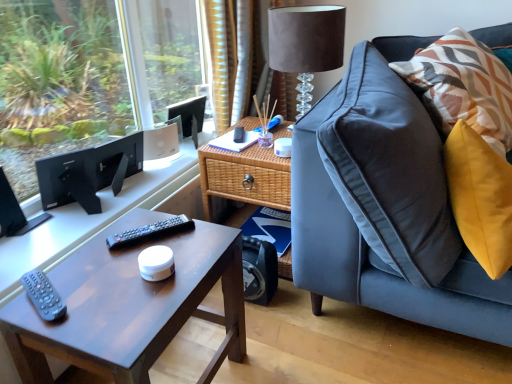
Image resolution: width=512 pixels, height=384 pixels. Find the location of `vacant space that's between black plastic remote at lower left, which ranks as the 2th remote in right-to-left order, and black plastic remote at center, the second remote ordered from the bottom`. vacant space that's between black plastic remote at lower left, which ranks as the 2th remote in right-to-left order, and black plastic remote at center, the second remote ordered from the bottom is located at coordinates (98, 269).